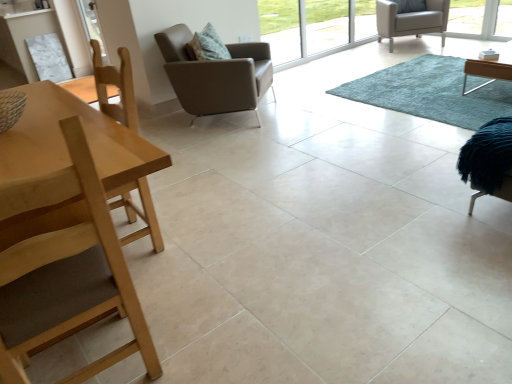
Question: In terms of width, does leather-like brown armchair at center, the 2th chair from the front, look wider or thinner when compared to light wood table at left?

Choices:
 (A) thin
 (B) wide

Answer: (B)

Question: In terms of height, does leather-like brown armchair at center, the second chair when ordered from right to left, look taller or shorter compared to light wood table at left?

Choices:
 (A) tall
 (B) short

Answer: (B)

Question: Estimate the real-world distances between objects in this image. Which object is farther from the transparent glass window at upper center?

Choices:
 (A) light wood table at left
 (B) light wood chair at left, arranged as the first chair when viewed from the left
 (C) transparent glass screen door at upper left
 (D) light brown leather armchair at upper right, which appears as the 1th chair when viewed from the right
 (E) blue shaggy rug at center

Answer: (B)

Question: Which object is the closest to the light brown leather armchair at upper right, which appears as the third chair when viewed from the front?

Choices:
 (A) light wood table at left
 (B) blue shaggy rug at center
 (C) leather-like brown armchair at center, the second chair in the top-to-bottom sequence
 (D) transparent glass window at upper center
 (E) transparent glass screen door at upper left

Answer: (D)